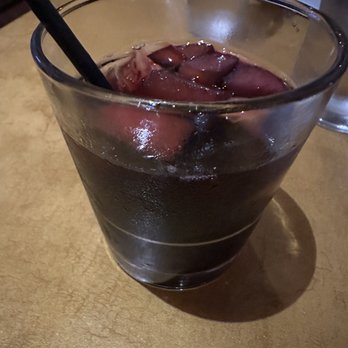
I want to click on beige cracked look table, so click(79, 300).